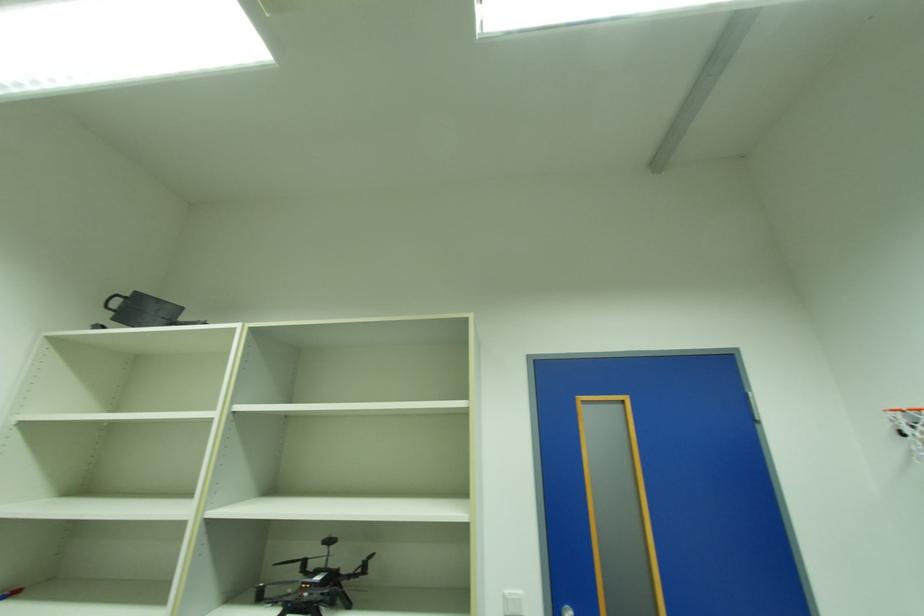
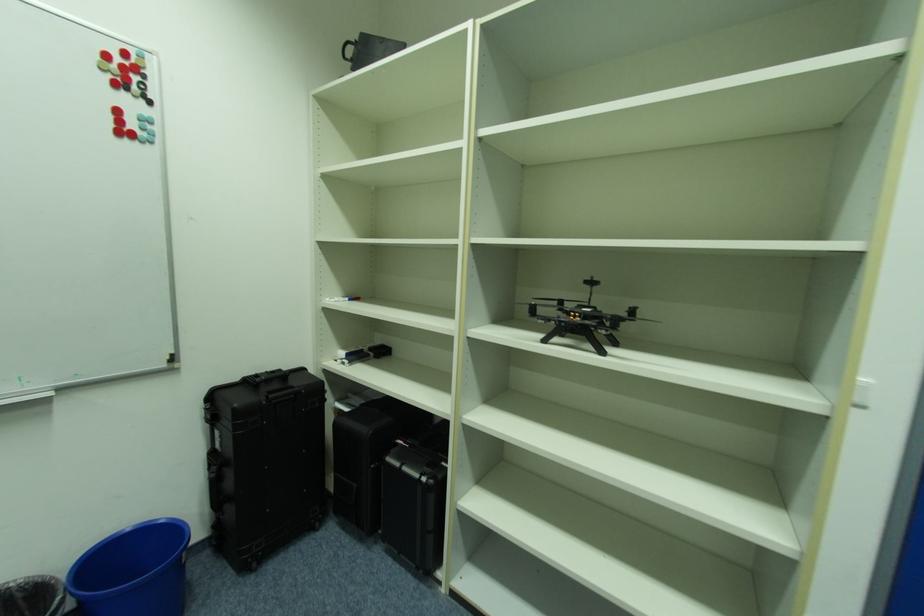
The first image is from the beginning of the video and the second image is from the end. How did the camera likely rotate when shooting the video?

The camera's rotation is toward left-down.